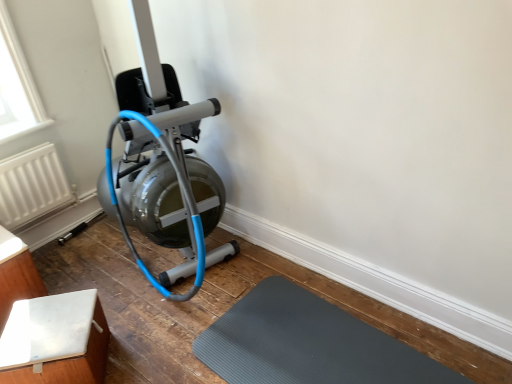
Question: Would you say matte silver stationary bicycle at left is outside white textured radiator at left?

Choices:
 (A) no
 (B) yes

Answer: (B)

Question: From the image's perspective, is matte silver stationary bicycle at left under white textured radiator at left?

Choices:
 (A) yes
 (B) no

Answer: (B)

Question: Is the surface of matte silver stationary bicycle at left in direct contact with white textured radiator at left?

Choices:
 (A) yes
 (B) no

Answer: (B)

Question: Considering the relative sizes of matte silver stationary bicycle at left and white textured radiator at left in the image provided, is matte silver stationary bicycle at left smaller than white textured radiator at left?

Choices:
 (A) yes
 (B) no

Answer: (B)

Question: Is matte silver stationary bicycle at left bigger than white textured radiator at left?

Choices:
 (A) yes
 (B) no

Answer: (A)

Question: Considering the relative positions of matte silver stationary bicycle at left and white textured radiator at left in the image provided, is matte silver stationary bicycle at left to the left of white textured radiator at left from the viewer's perspective?

Choices:
 (A) yes
 (B) no

Answer: (B)

Question: Is white matte table at lower left, the 1th furniture when ordered from right to left, beside gray rubber mat at lower center?

Choices:
 (A) no
 (B) yes

Answer: (A)

Question: Is white matte table at lower left, the 1th furniture when ordered from right to left, further to the viewer compared to gray rubber mat at lower center?

Choices:
 (A) no
 (B) yes

Answer: (B)

Question: Is white matte table at lower left, the 2th furniture viewed from the left, in front of gray rubber mat at lower center?

Choices:
 (A) no
 (B) yes

Answer: (A)

Question: From the image's perspective, is white matte table at lower left, the 2th furniture viewed from the left, beneath gray rubber mat at lower center?

Choices:
 (A) no
 (B) yes

Answer: (A)

Question: Is white matte table at lower left, the 1th furniture when ordered from right to left, to the right of gray rubber mat at lower center from the viewer's perspective?

Choices:
 (A) no
 (B) yes

Answer: (A)

Question: Does white matte table at lower left, the 2th furniture viewed from the left, have a greater height compared to gray rubber mat at lower center?

Choices:
 (A) no
 (B) yes

Answer: (B)

Question: Is gray rubber mat at lower center outside white matte table at lower left, the 2th furniture from the right?

Choices:
 (A) yes
 (B) no

Answer: (A)